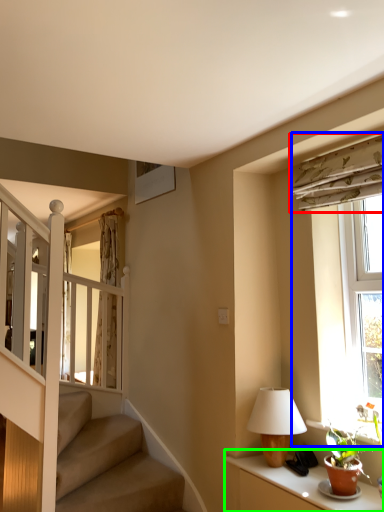
Question: Estimate the real-world distances between objects in this image. Which object is farther from curtain (highlighted by a red box), window (highlighted by a blue box) or table (highlighted by a green box)?

Choices:
 (A) window
 (B) table

Answer: (B)